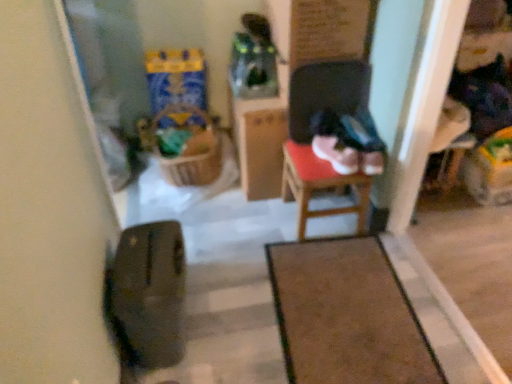
This screenshot has height=384, width=512. Find the location of `free space between wooden chair at center and brown carpet at center`. free space between wooden chair at center and brown carpet at center is located at coordinates (285, 229).